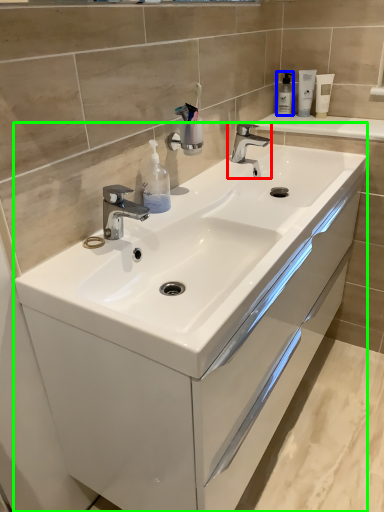
Question: Which object is positioned farthest from tap (highlighted by a red box)? Select from soap dispenser (highlighted by a blue box) and bathroom cabinet (highlighted by a green box).

Choices:
 (A) soap dispenser
 (B) bathroom cabinet

Answer: (B)